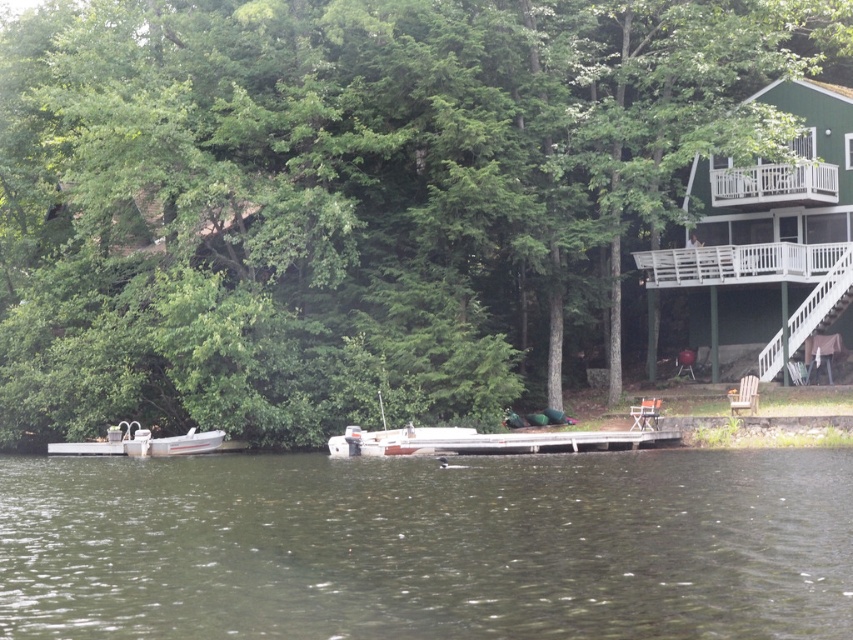
Does point (817, 125) come closer to viewer compared to point (196, 433)?

No, it is not.

Is the position of green wood cabin at upper right less distant than that of white plastic boat at lower left?

That is False.

Is point (750, 310) positioned in front of point (184, 444)?

No.

The image size is (853, 640). I want to click on green wood cabin at upper right, so click(772, 230).

Consider the image. Is green leafy tree at center behind white plastic boat at lower left?

No, it is not.

From the picture: Does green leafy tree at center have a smaller size compared to white plastic boat at lower left?

Incorrect, green leafy tree at center is not smaller in size than white plastic boat at lower left.

Measure the distance between point (x=225, y=128) and camera.

Point (x=225, y=128) is 41.13 meters from camera.

Locate an element on the screen. The width and height of the screenshot is (853, 640). green leafy tree at center is located at coordinates (347, 196).

Identify the location of greenish water at center. The width and height of the screenshot is (853, 640). (428, 545).

Is greenish water at center positioned before white plastic boat at lower left?

Yes, it is in front of white plastic boat at lower left.

You are a GUI agent. You are given a task and a screenshot of the screen. Output one action in this format:
    pyautogui.click(x=<x>, y=<y>)
    Task: Click on the greenish water at center
    
    Given the screenshot: What is the action you would take?
    pyautogui.click(x=428, y=545)